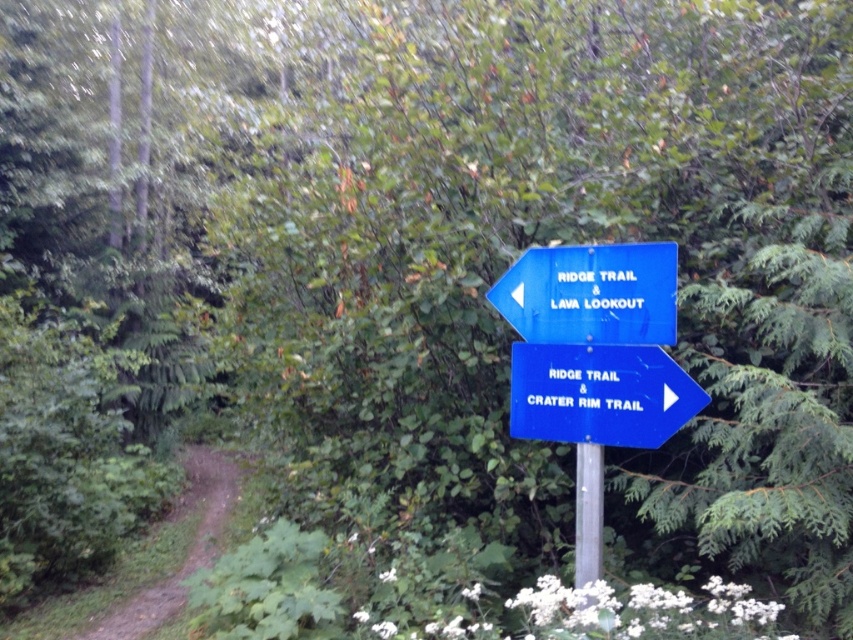
Question: Which object is positioned farthest from the metallic pole at center?

Choices:
 (A) blue plastic arrow at upper center
 (B) white plastic arrow at center right
 (C) blue plastic sign at upper right
 (D) blue plastic sign at center

Answer: (A)

Question: Which point is closer to the camera taking this photo?

Choices:
 (A) pyautogui.click(x=668, y=397)
 (B) pyautogui.click(x=120, y=616)

Answer: (A)

Question: Does blue plastic sign at upper right have a greater width compared to white plastic arrow at center right?

Choices:
 (A) yes
 (B) no

Answer: (A)

Question: Is dirt path at lower left wider than white plastic arrow at center right?

Choices:
 (A) no
 (B) yes

Answer: (B)

Question: Which point appears closest to the camera in this image?

Choices:
 (A) coord(558,369)
 (B) coord(581,516)
 (C) coord(598,305)
 (D) coord(664,404)

Answer: (D)

Question: Is dirt path at lower left thinner than white plastic arrow at center right?

Choices:
 (A) no
 (B) yes

Answer: (A)